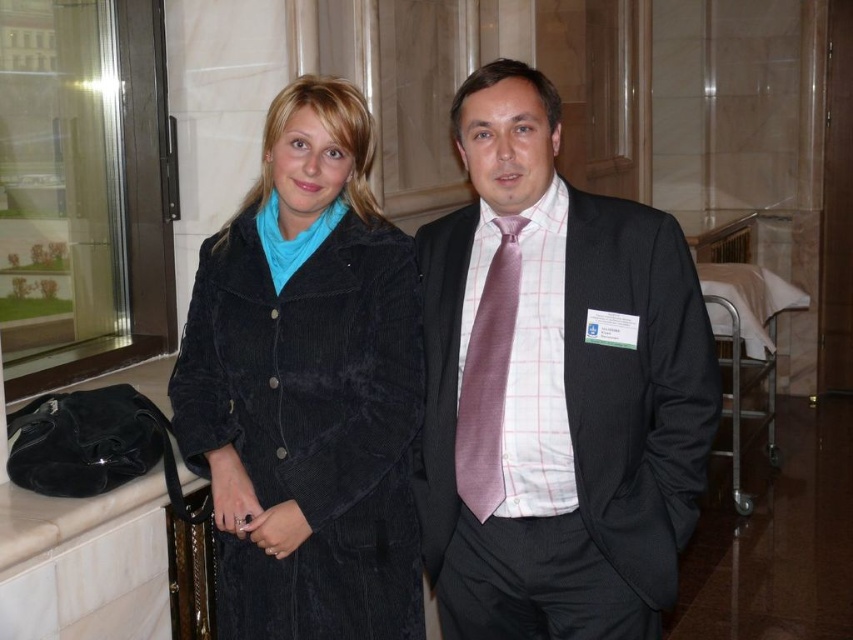
Question: Is corduroy coat at center closer to the viewer compared to pink silk tie at center?

Choices:
 (A) no
 (B) yes

Answer: (B)

Question: Which object appears closest to the camera in this image?

Choices:
 (A) pink silk tie at center
 (B) matte black suit at center

Answer: (B)

Question: Which point is farther to the camera?

Choices:
 (A) (387, 502)
 (B) (502, 472)

Answer: (A)

Question: Which object is positioned farthest from the matte black suit at center?

Choices:
 (A) corduroy coat at center
 (B) pink silk tie at center

Answer: (A)

Question: Does corduroy coat at center have a lesser width compared to pink silk tie at center?

Choices:
 (A) no
 (B) yes

Answer: (A)

Question: Is corduroy coat at center smaller than pink silk tie at center?

Choices:
 (A) no
 (B) yes

Answer: (A)